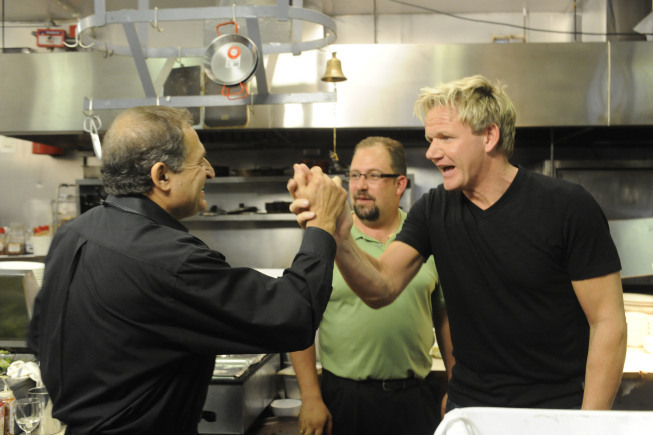
The image size is (653, 435). In order to click on aluminum venting system in this screenshot , I will do `click(387, 79)`.